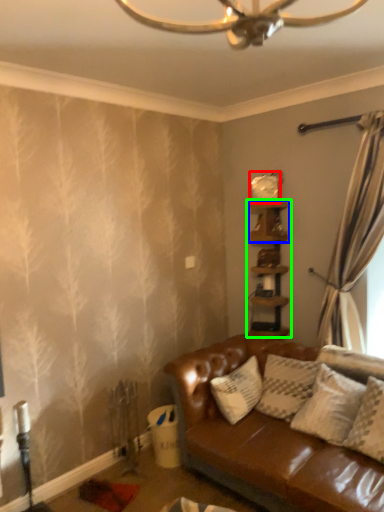
Question: Based on their relative distances, which object is farther from clock (highlighted by a red box)? Choose from shelf (highlighted by a blue box) and shelf (highlighted by a green box).

Choices:
 (A) shelf
 (B) shelf

Answer: (B)